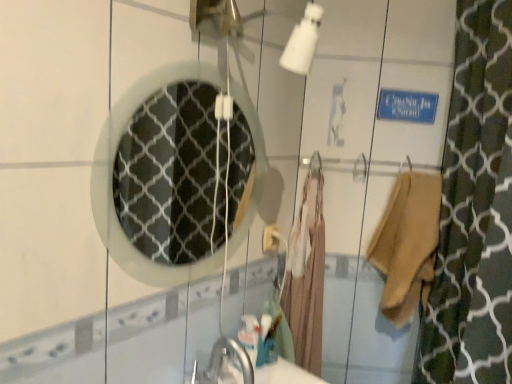
Question: Is beige fabric bathrobe at center to the left or to the right of beige cotton robe at right in the image?

Choices:
 (A) left
 (B) right

Answer: (A)

Question: Is beige fabric bathrobe at center spatially inside beige cotton robe at right, or outside of it?

Choices:
 (A) outside
 (B) inside

Answer: (A)

Question: Based on their relative distances, which object is nearer to the white textured mirror at center?

Choices:
 (A) beige cotton robe at right
 (B) beige fabric bathrobe at center

Answer: (B)

Question: Considering the real-world distances, which object is closest to the beige cotton robe at right?

Choices:
 (A) beige fabric bathrobe at center
 (B) white textured mirror at center

Answer: (A)